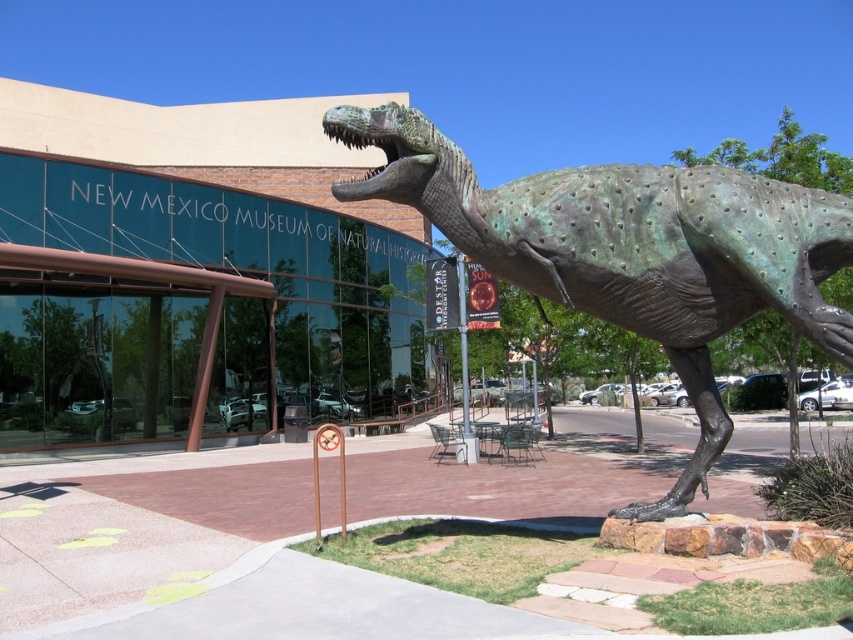
You are standing outside the New Mexico Museum of Natural History and want to take a photo of the green glass building at center. If your camera has a maximum zoom range of 10 meters, will you be able to capture the entire building in your photo without moving closer?

The distance between you and the green glass building at center is 13.43 meters, which exceeds the camera maximum zoom range of 10 meters. Therefore, you won not be able to capture the entire building in your photo without moving closer.

You are a visitor standing in front of the New Mexico Museum of Natural History. You notice the green glass building at center and the green patina dinosaur at center. Which object is taller?

The green glass building at center is taller than the green patina dinosaur at center.